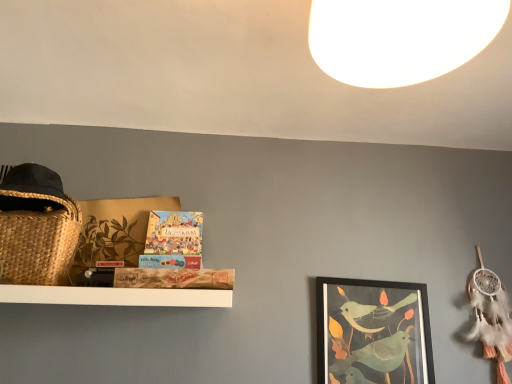
Question: Is white matte light at upper center in front of or behind matte board game at center in the image?

Choices:
 (A) behind
 (B) front

Answer: (B)

Question: Would you say white matte light at upper center is to the left or to the right of matte board game at center in the picture?

Choices:
 (A) right
 (B) left

Answer: (A)

Question: Which is farther from the matte board game at center?

Choices:
 (A) matte black picture frame at center right
 (B) white matte light at upper center

Answer: (B)

Question: Estimate the real-world distances between objects in this image. Which object is farther from the white matte light at upper center?

Choices:
 (A) matte black picture frame at center right
 (B) matte board game at center

Answer: (A)